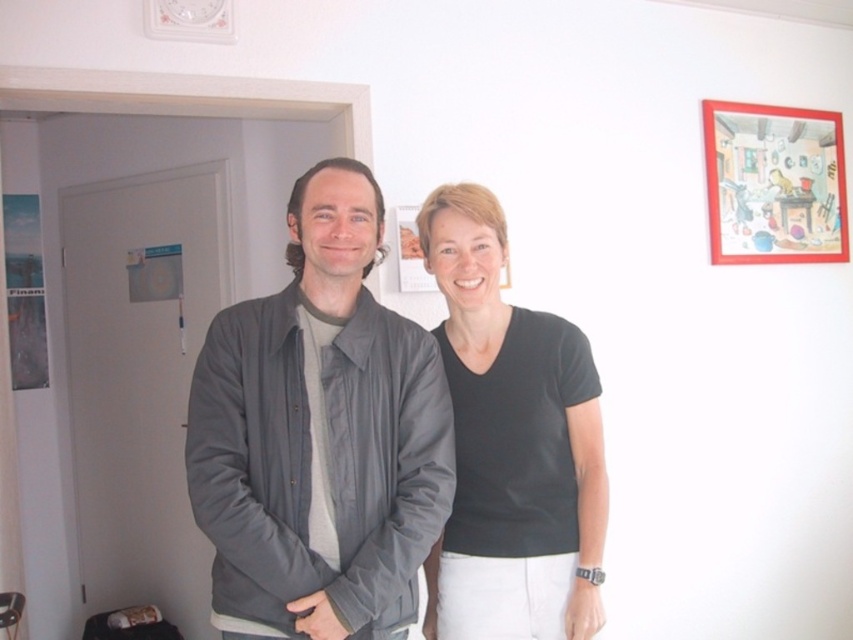
Question: Which point is farther to the camera?

Choices:
 (A) (329, 413)
 (B) (813, 237)
 (C) (525, 374)

Answer: (B)

Question: Does black matte shirt at center appear on the right side of matte red picture frame at upper right?

Choices:
 (A) no
 (B) yes

Answer: (A)

Question: From the image, what is the correct spatial relationship of gray fabric jacket at center in relation to black matte shirt at center?

Choices:
 (A) below
 (B) above

Answer: (B)

Question: Which object appears closest to the camera in this image?

Choices:
 (A) gray fabric jacket at center
 (B) black matte shirt at center

Answer: (A)

Question: Estimate the real-world distances between objects in this image. Which object is closer to the matte red picture frame at upper right?

Choices:
 (A) black matte shirt at center
 (B) gray fabric jacket at center

Answer: (A)

Question: Can you confirm if gray fabric jacket at center is smaller than matte red picture frame at upper right?

Choices:
 (A) yes
 (B) no

Answer: (B)